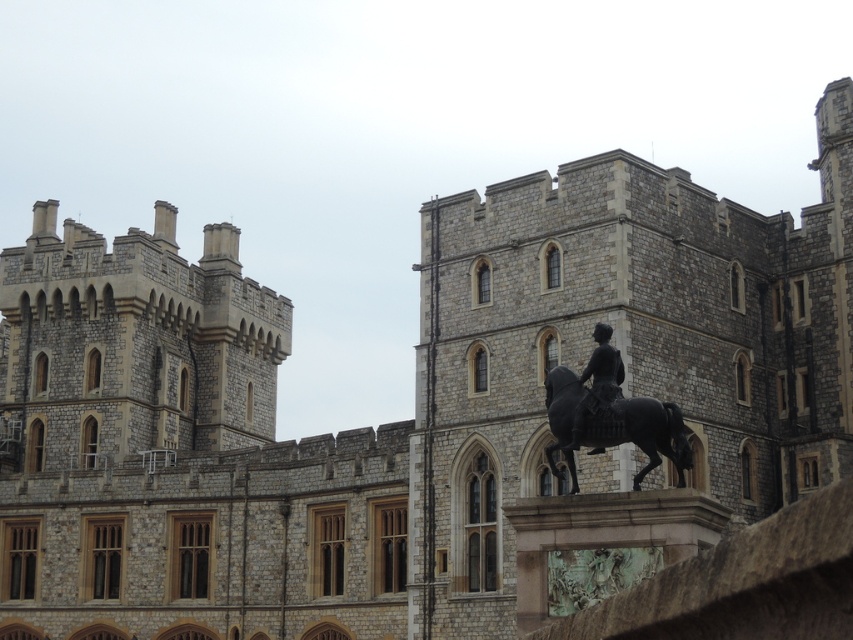
Question: Which object is farther from the camera taking this photo?

Choices:
 (A) shiny black horse at center
 (B) polished bronze statue at center

Answer: (B)

Question: Among these points, which one is farthest from the camera?

Choices:
 (A) (654, 442)
 (B) (589, 362)

Answer: (B)

Question: Is shiny black horse at center below polished bronze statue at center?

Choices:
 (A) no
 (B) yes

Answer: (B)

Question: Does shiny black horse at center have a smaller size compared to polished bronze statue at center?

Choices:
 (A) yes
 (B) no

Answer: (B)

Question: Is shiny black horse at center above polished bronze statue at center?

Choices:
 (A) no
 (B) yes

Answer: (A)